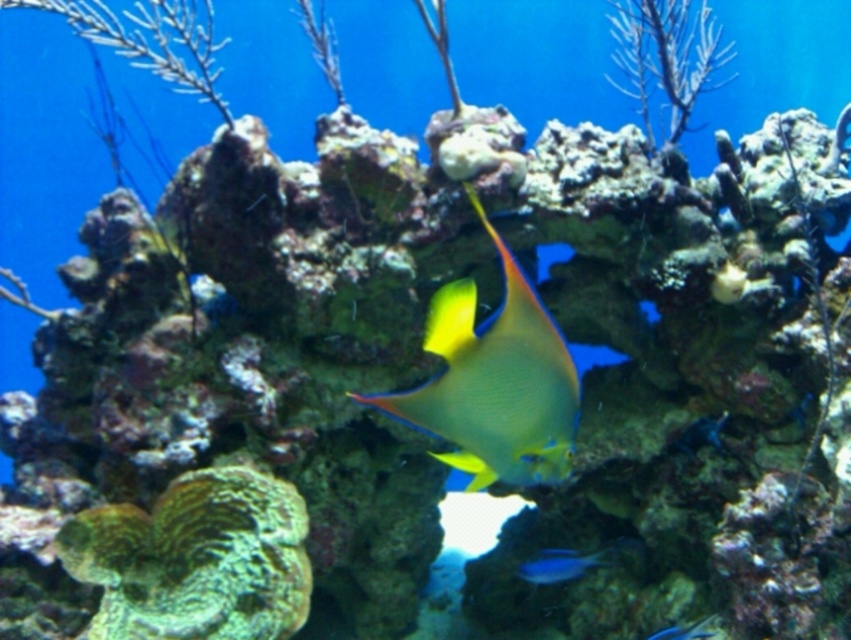
Which is above, yellow matte fish at center or blue glossy fish at center?

Positioned higher is yellow matte fish at center.

Does point (533, 412) come in front of point (604, 548)?

Yes, point (533, 412) is closer to viewer.

This screenshot has height=640, width=851. What do you see at coordinates (494, 381) in the screenshot? I see `yellow matte fish at center` at bounding box center [494, 381].

Locate an element on the screen. Image resolution: width=851 pixels, height=640 pixels. yellow matte fish at center is located at coordinates (494, 381).

Does point (540, 557) come in front of point (672, 632)?

No.

Can you confirm if blue glossy fish at center is positioned below shiny blue fish at center?

Actually, blue glossy fish at center is above shiny blue fish at center.

What do you see at coordinates (558, 564) in the screenshot?
I see `blue glossy fish at center` at bounding box center [558, 564].

Where is `blue glossy fish at center`? blue glossy fish at center is located at coordinates (558, 564).

Is yellow matte fish at center shorter than shiny blue fish at center?

No.

Does yellow matte fish at center have a lesser width compared to shiny blue fish at center?

Incorrect, yellow matte fish at center's width is not less than shiny blue fish at center's.

Find the location of `yellow matte fish at center`. yellow matte fish at center is located at coordinates (494, 381).

I want to click on yellow matte fish at center, so click(x=494, y=381).